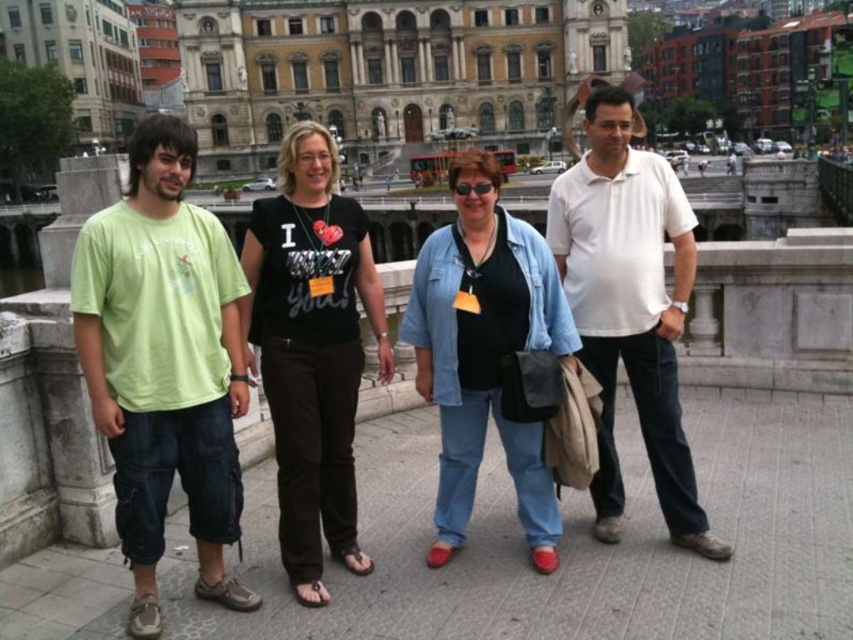
You are trying to determine the clothing layers of the individuals in the scene. According to the image, which clothing item is visible on top between the white cotton polo shirt at center and the denim jacket at center?

The white cotton polo shirt at center is positioned over the denim jacket at center, so the white cotton polo shirt at center is visible on top.

You are standing on the bridge looking at the group of people. There are two points marked in the image. Which point is closer to you, point 1 at coordinates [677,280] or point 2 at coordinates [502,324]?

Point 1 at coordinates [677,280] is closer to you because it is further to the viewer than point 2 at coordinates [502,324].